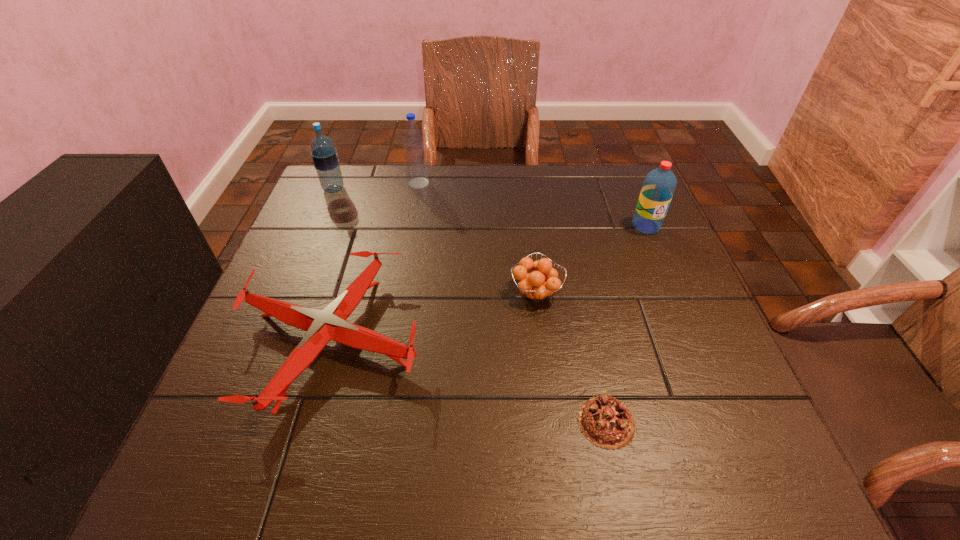
This screenshot has width=960, height=540. I want to click on vacant position located on the back of the orange fruit, so click(530, 246).

Find the location of a particular element. free point located on the right of the drone is located at coordinates (x=507, y=339).

Locate an element on the screen. This screenshot has width=960, height=540. blank area located on the right of the shortest object is located at coordinates (716, 422).

Where is `object present at the near edge`? The width and height of the screenshot is (960, 540). object present at the near edge is located at coordinates (604, 420).

I want to click on water bottle located at the left edge, so click(x=324, y=155).

You are a GUI agent. You are given a task and a screenshot of the screen. Output one action in this format:
    pyautogui.click(x=<x>, y=<y>)
    Task: Click on the drone at the left edge
    
    Given the screenshot: What is the action you would take?
    pyautogui.click(x=330, y=323)

I want to click on object that is at the right edge, so click(659, 185).

This screenshot has width=960, height=540. Identify the location of object positioned at the far left corner. (x=324, y=155).

I want to click on free point at the far edge, so click(473, 202).

Find the location of a particular element. The width and height of the screenshot is (960, 540). vacant position at the near edge of the desktop is located at coordinates (541, 482).